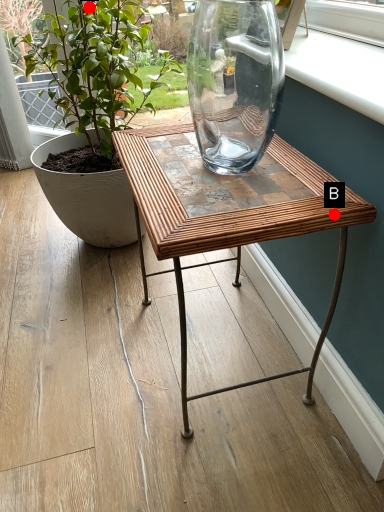
Question: Two points are circled on the image, labeled by A and B beside each circle. Among these points, which one is farthest from the camera?

Choices:
 (A) A is further
 (B) B is further

Answer: (A)